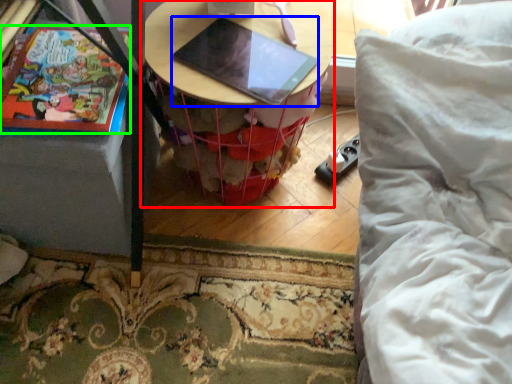
Question: Estimate the real-world distances between objects in this image. Which object is farther from table (highlighted by a red box), laptop (highlighted by a blue box) or comic book (highlighted by a green box)?

Choices:
 (A) laptop
 (B) comic book

Answer: (B)